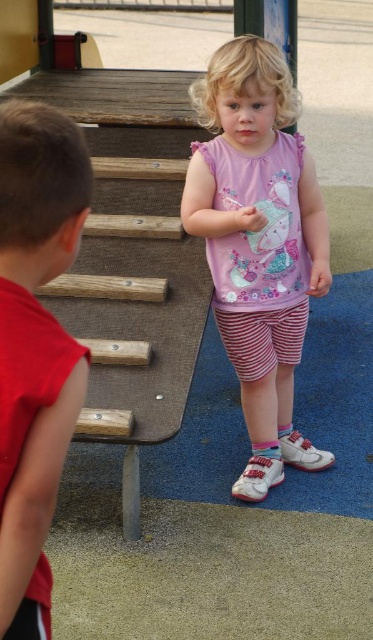
You are a photographer trying to capture both children in a single shot. The camera frame can only accommodate the width of the red fabric sleeveless shirt at left. Will the pink fabric shirt at center fit within the frame?

The pink fabric shirt at center is wider than the red fabric sleeveless shirt at left. Since the camera frame can only fit the width of the red fabric sleeveless shirt at left, the pink fabric shirt at center will not fit within the frame.

You are a photographer trying to capture both the pink fabric shirt at center and the red fabric sleeveless shirt at left in a single photo. Given that your camera has a maximum focus range of 5 feet, will you be able to include both in the photo without moving closer?

The pink fabric shirt at center and the red fabric sleeveless shirt at left are 5.53 feet apart, which exceeds the camera maximum focus range of 5 feet. Therefore, you cannot include both in the photo without moving closer.